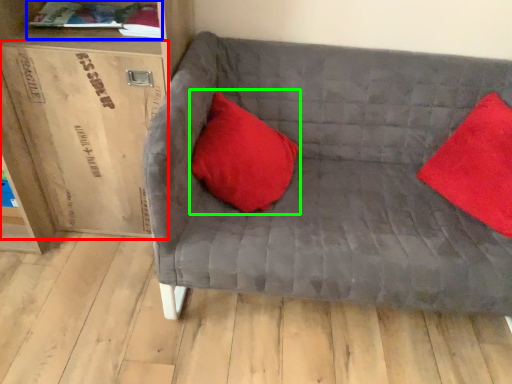
Question: Based on their relative distances, which object is nearer to cardboard box (highlighted by a red box)? Choose from book (highlighted by a blue box) and pillow (highlighted by a green box).

Choices:
 (A) book
 (B) pillow

Answer: (A)